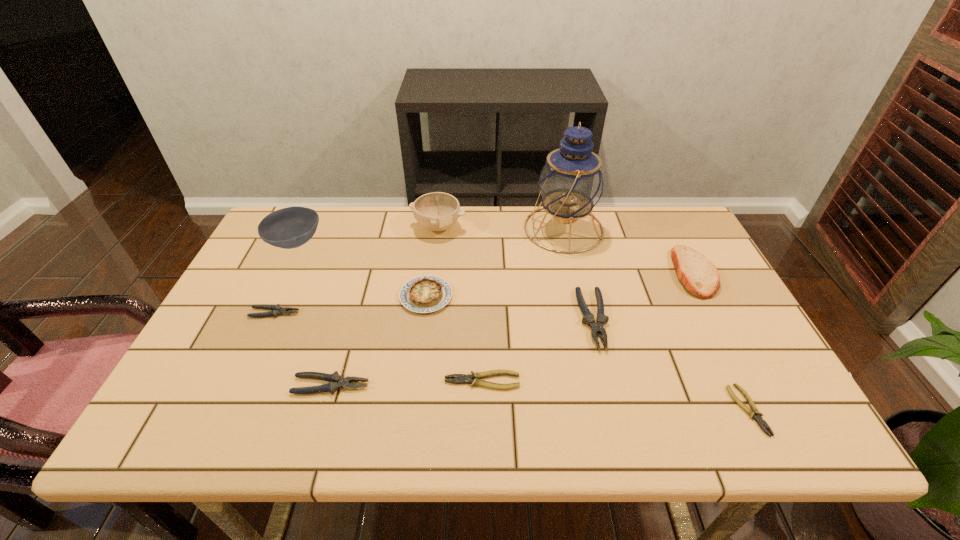
The width and height of the screenshot is (960, 540). Find the location of `free spot that satisfies the following two spatial constraints: 1. on the front side of the pita bread; 2. at the gripping part of the leftmost gray pliers`. free spot that satisfies the following two spatial constraints: 1. on the front side of the pita bread; 2. at the gripping part of the leftmost gray pliers is located at coordinates (714, 313).

I want to click on vacant space that satisfies the following two spatial constraints: 1. on the front side of the smaller yellow pliers; 2. on the left side of the quiche, so click(412, 410).

This screenshot has height=540, width=960. In order to click on vacant area that satisfies the following two spatial constraints: 1. at the gripping part of the eighth tallest object; 2. on the left side of the rightmost pliers in this screenshot , I will do pyautogui.click(x=230, y=410).

Identify the location of vacant position in the image that satisfies the following two spatial constraints: 1. at the gripping part of the bigger yellow pliers; 2. on the left side of the leftmost gray pliers. Image resolution: width=960 pixels, height=540 pixels. (244, 381).